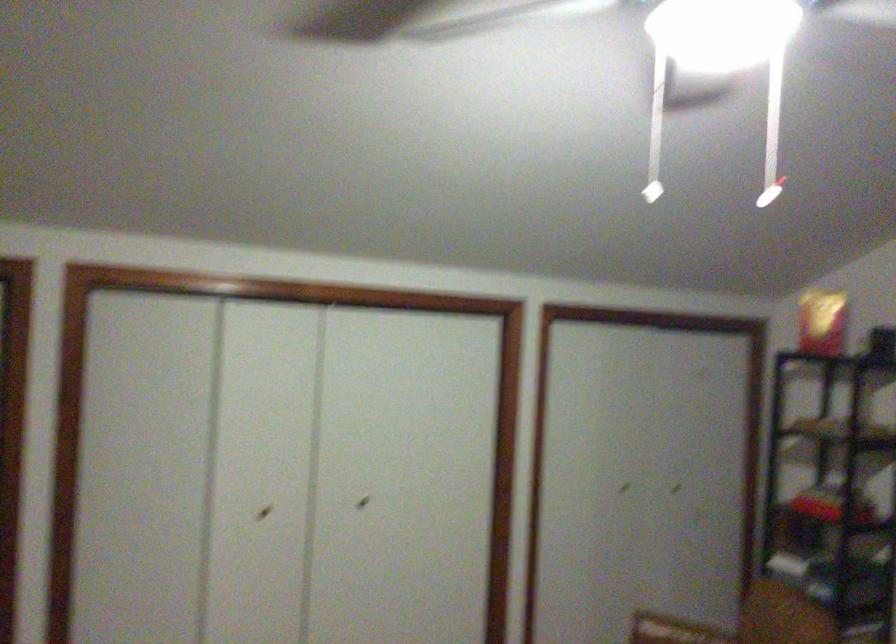
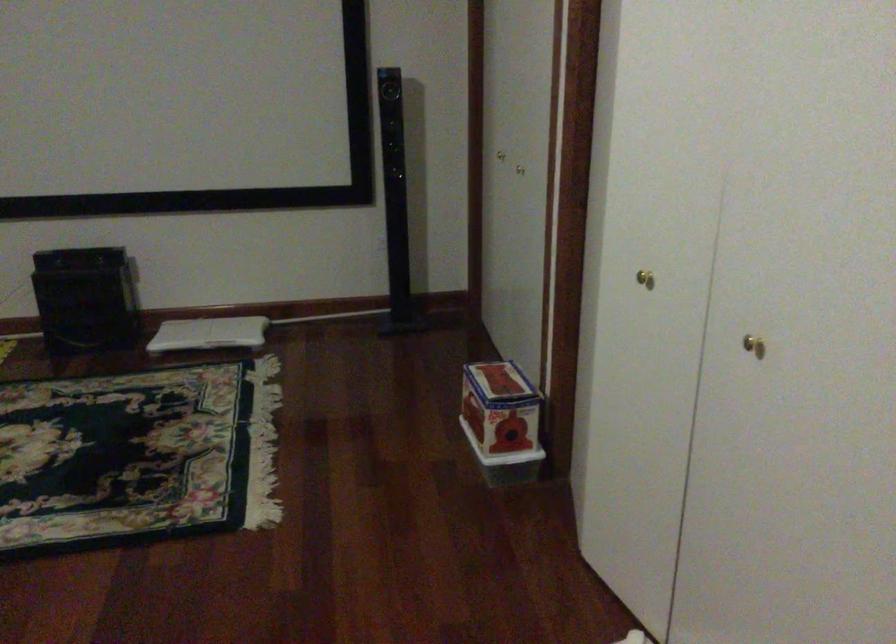
The point at (251, 507) is marked in the first image. Where is the corresponding point in the second image?

(644, 279)